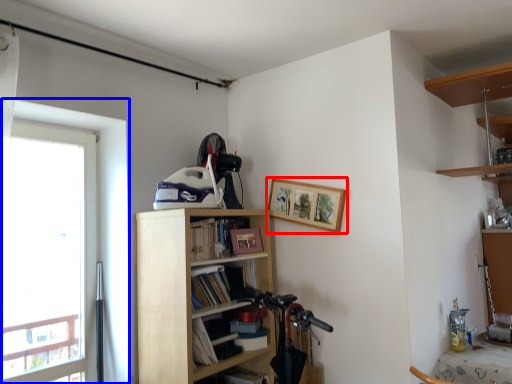
Question: Which of the following is the farthest to the observer, picture frame (highlighted by a red box) or window (highlighted by a blue box)?

Choices:
 (A) picture frame
 (B) window

Answer: (A)